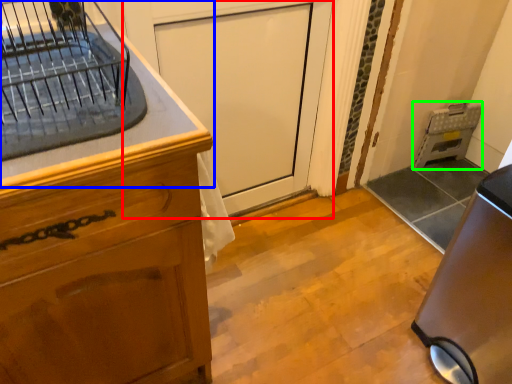
Question: Which object is the closest to the screen door (highlighted by a red box)? Choose among these: countertop (highlighted by a blue box) or appliance (highlighted by a green box).

Choices:
 (A) countertop
 (B) appliance

Answer: (A)